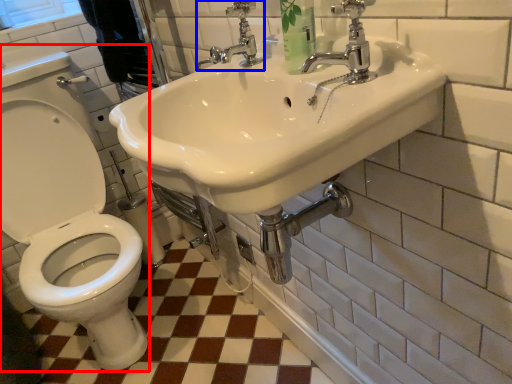
Question: Which of the following is the farthest to the observer, sit (highlighted by a red box) or tap (highlighted by a blue box)?

Choices:
 (A) sit
 (B) tap

Answer: (A)